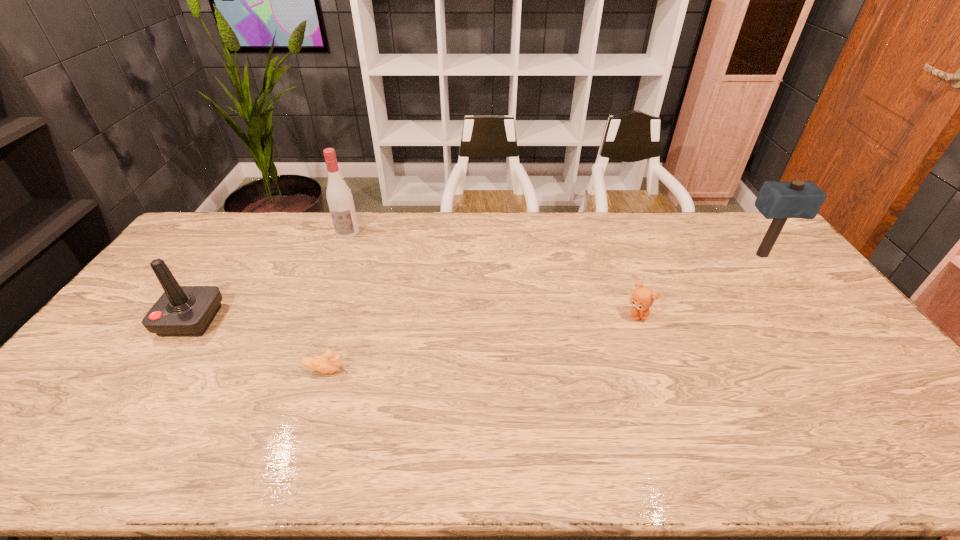
Locate an element on the screen. This screenshot has width=960, height=540. free space that is in between the third tallest object and the teddy bear is located at coordinates (414, 317).

Where is `unoccupied area between the fourth object from left to right and the farthest object`? This screenshot has height=540, width=960. unoccupied area between the fourth object from left to right and the farthest object is located at coordinates (492, 274).

What are the coordinates of `vacant area that lies between the duckling and the second object from right to left` in the screenshot? It's located at (481, 342).

Find the location of a particular element. free space between the teddy bear and the leftmost object is located at coordinates (414, 317).

At what (x,y) coordinates should I click in order to perform the action: click on free space between the second shortest object and the duckling. Please return your answer as a coordinate pair (x, y). The width and height of the screenshot is (960, 540). Looking at the image, I should click on (481, 342).

Find the location of a particular element. The height and width of the screenshot is (540, 960). object that ranks as the closest to the joystick is located at coordinates (329, 363).

Locate which object ranks in proximity to the farthest object. Please provide its 2D coordinates. Your answer should be formatted as a tuple, i.e. [(x, y)], where the tuple contains the x and y coordinates of a point satisfying the conditions above.

[(182, 311)]

Find the location of a particular element. This screenshot has width=960, height=540. blank area in the image that satisfies the following two spatial constraints: 1. on the face of the teddy bear; 2. on the face of the shortest object is located at coordinates (658, 370).

This screenshot has width=960, height=540. I want to click on vacant space that satisfies the following two spatial constraints: 1. on the label of the second farthest object; 2. on the right side of the alcohol, so click(x=339, y=255).

Image resolution: width=960 pixels, height=540 pixels. Identify the location of free space that satisfies the following two spatial constraints: 1. on the label of the rightmost object; 2. on the right side of the alcohol. (339, 255).